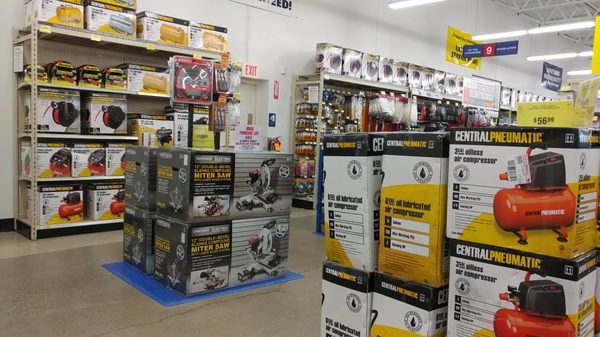
Locate an element on the screen. shelf is located at coordinates (33, 84).